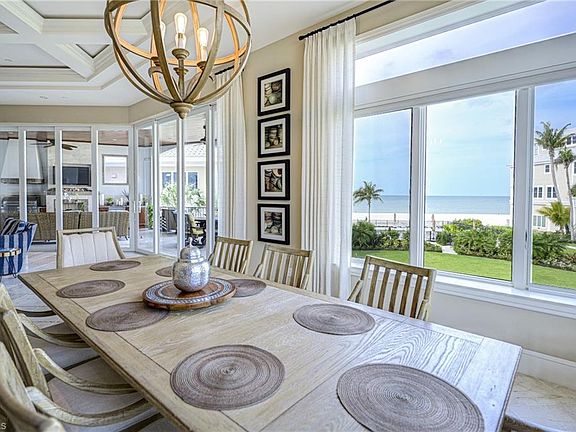
I want to click on end chair, so click(100, 252).